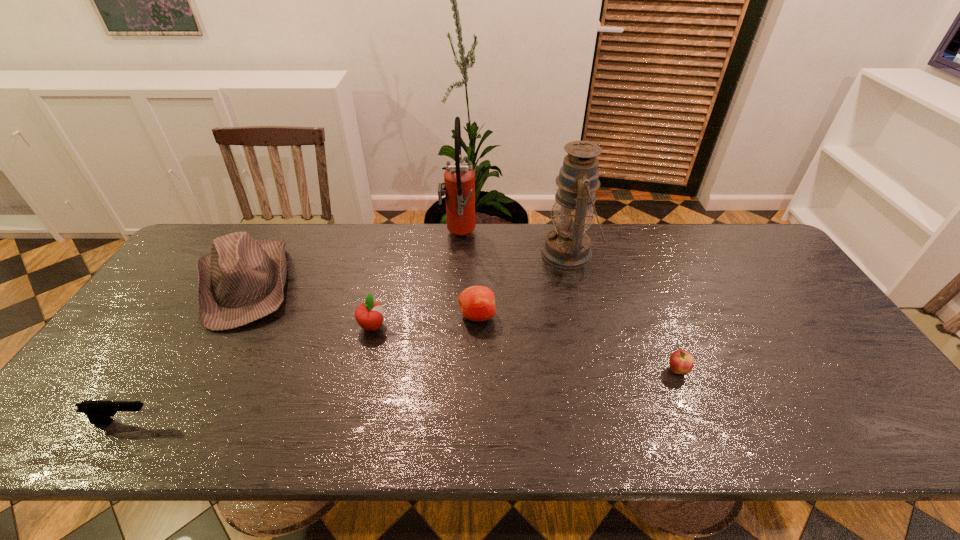
Find the location of a particular element. apple that stands as the second closest to the pistol is located at coordinates (476, 303).

Where is `apple that is the second closest to the rightmost object`? The image size is (960, 540). apple that is the second closest to the rightmost object is located at coordinates (369, 315).

This screenshot has width=960, height=540. Find the location of `free location that satisfies the following two spatial constraints: 1. on the back side of the second object from right to left; 2. at the nozzle of the fire extinguisher`. free location that satisfies the following two spatial constraints: 1. on the back side of the second object from right to left; 2. at the nozzle of the fire extinguisher is located at coordinates (565, 236).

Find the location of `free space that satisfies the following two spatial constraints: 1. on the back side of the oil lamp; 2. at the nozzle of the fire extinguisher`. free space that satisfies the following two spatial constraints: 1. on the back side of the oil lamp; 2. at the nozzle of the fire extinguisher is located at coordinates (565, 236).

Find the location of a particular element. The height and width of the screenshot is (540, 960). free location that satisfies the following two spatial constraints: 1. on the back side of the sixth object from left to right; 2. on the left side of the fifth object from right to left is located at coordinates [x=390, y=253].

Where is `free space that satisfies the following two spatial constraints: 1. on the front side of the nearest apple; 2. on the right side of the second apple from left to right`? free space that satisfies the following two spatial constraints: 1. on the front side of the nearest apple; 2. on the right side of the second apple from left to right is located at coordinates tap(476, 370).

Where is `free space that satisfies the following two spatial constraints: 1. at the nozzle of the second object from right to left; 2. on the left side of the fire extinguisher`? This screenshot has width=960, height=540. free space that satisfies the following two spatial constraints: 1. at the nozzle of the second object from right to left; 2. on the left side of the fire extinguisher is located at coordinates (457, 253).

I want to click on free spot that satisfies the following two spatial constraints: 1. at the nozzle of the fire extinguisher; 2. on the back side of the oil lamp, so click(x=457, y=253).